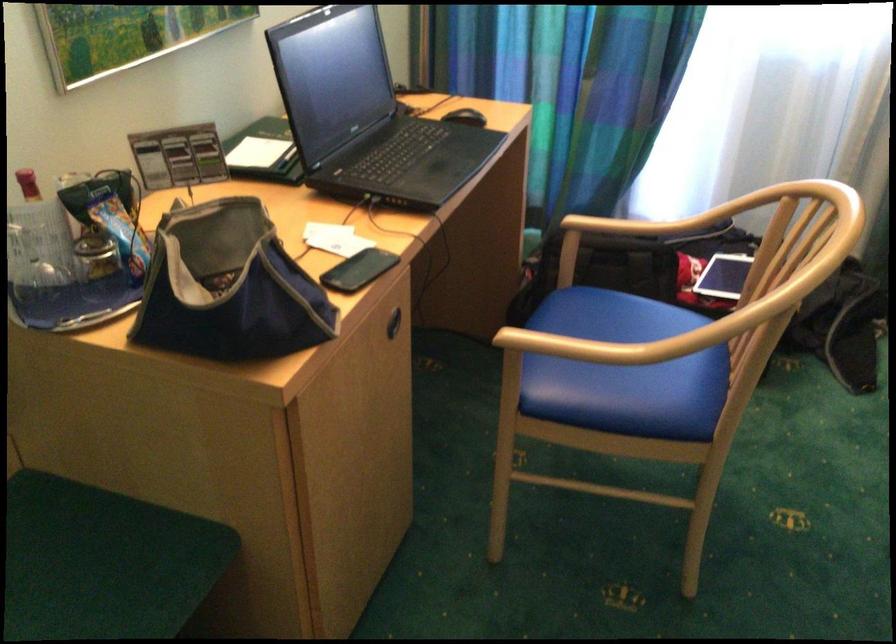
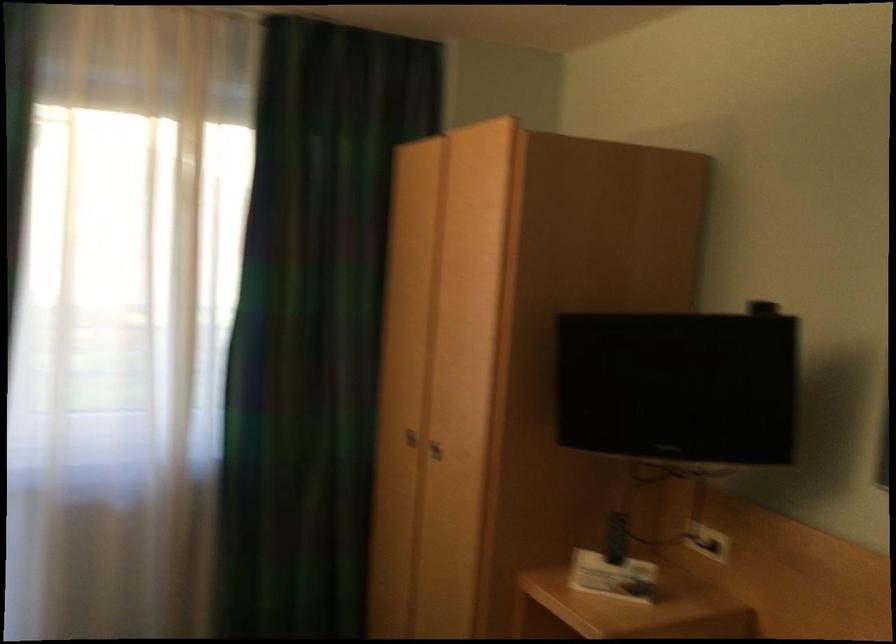
How did the camera likely rotate?

The camera's rotation is toward right-up.